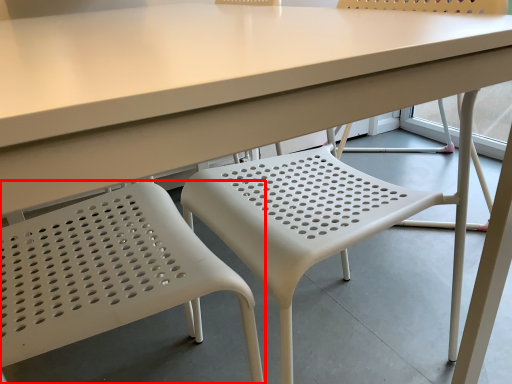
Question: In this image, where is chair (annotated by the red box) located relative to chair?

Choices:
 (A) left
 (B) right

Answer: (A)